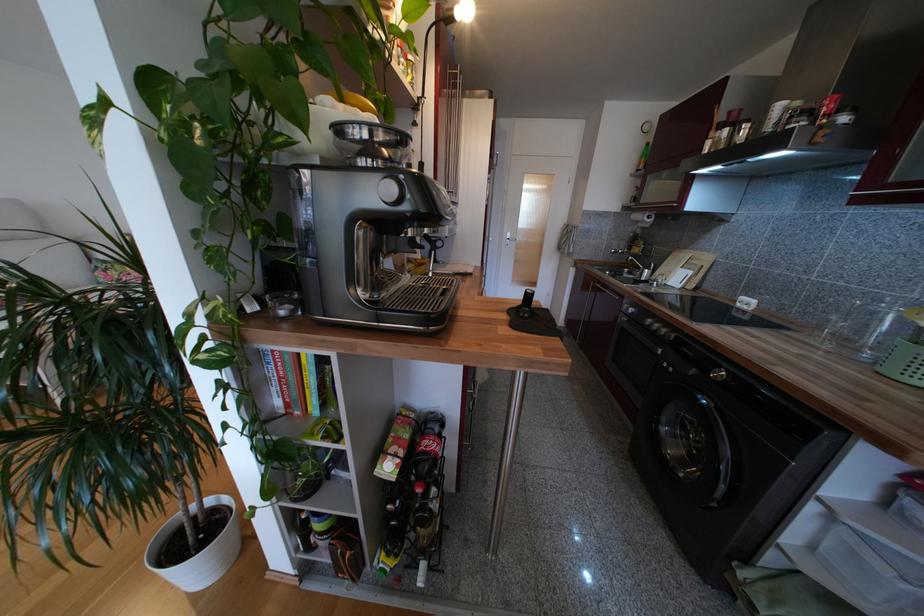
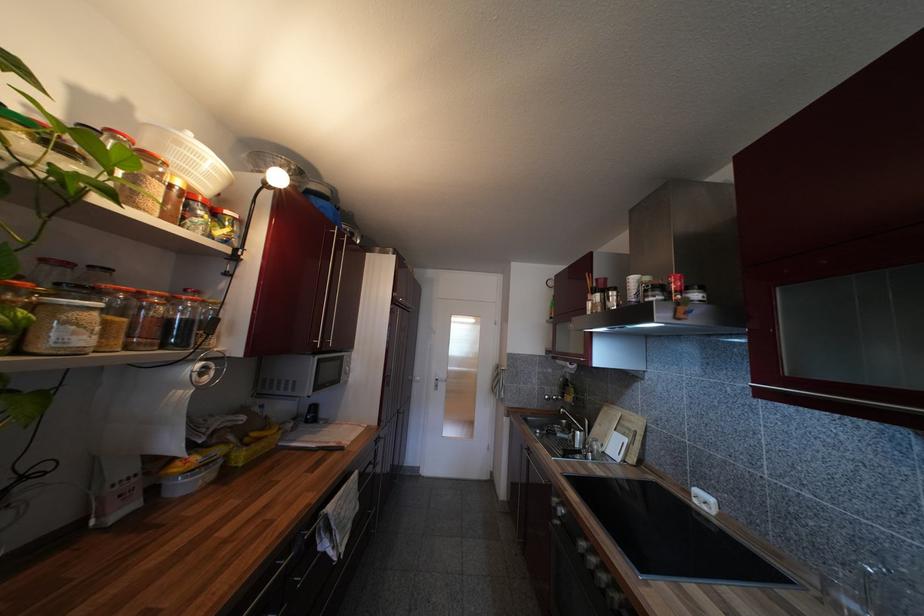
Where in the second image is the point corresponding to [675,275] from the first image?

(610, 438)